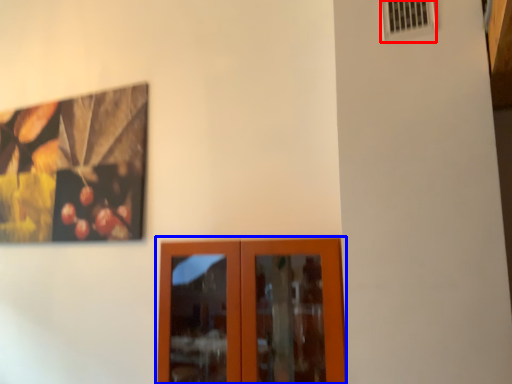
Question: Among these objects, which one is farthest to the camera, air conditioning (highlighted by a red box) or door (highlighted by a blue box)?

Choices:
 (A) air conditioning
 (B) door

Answer: (B)